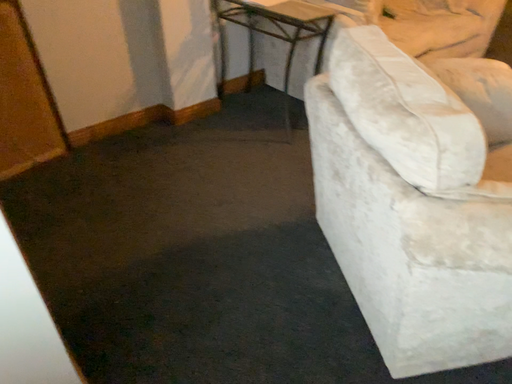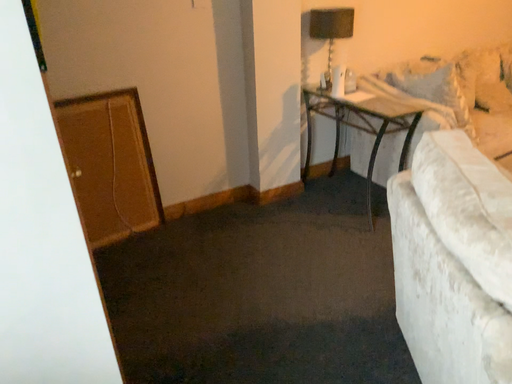
Question: How did the camera likely rotate when shooting the video?

Choices:
 (A) rotated right
 (B) rotated left

Answer: (B)